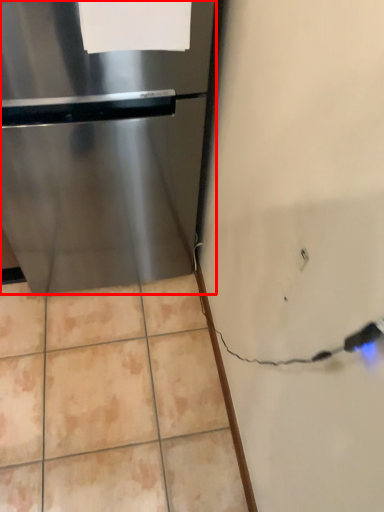
Question: From the image's perspective, where is refrigerator (annotated by the red box) located relative to paper?

Choices:
 (A) above
 (B) below

Answer: (B)